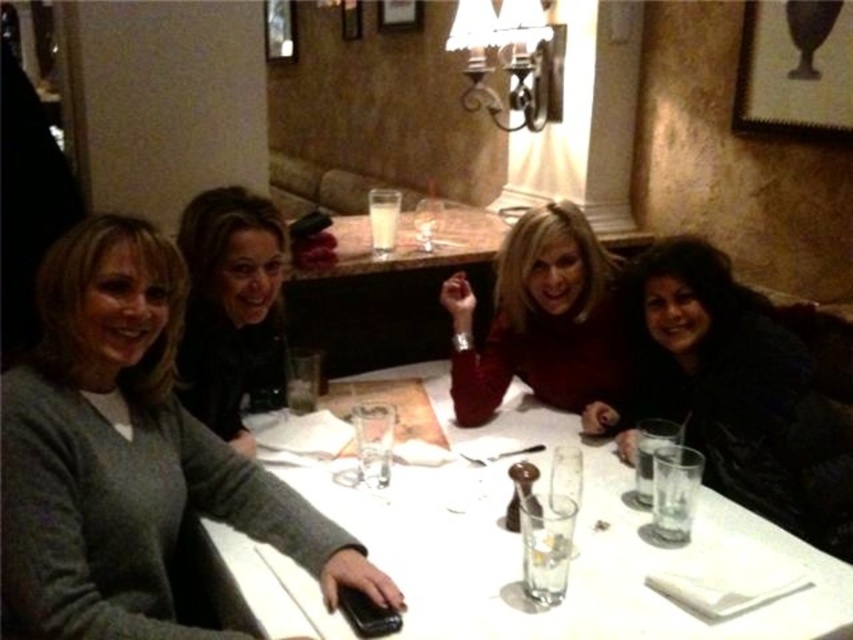
You are a photographer taking a picture of the dark brown hair at upper left and the clear glass wine glass at center. Which object is wider in the image?

The dark brown hair at upper left might be wider than the clear glass wine glass at center.

You are a server who needs to place a 30 cm wide platter on the white glossy table at center without touching the matte red sweater at center. Is there enough space?

The distance between the white glossy table at center and the matte red sweater at center is 34.66 centimeters. Since the platter is 30 cm wide, there is sufficient space to place it without touching the sweater.